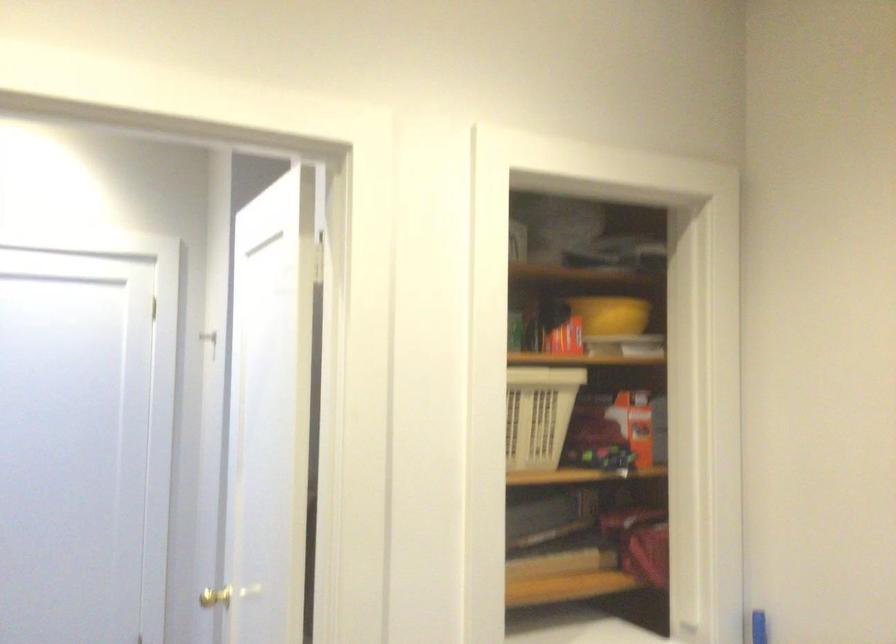
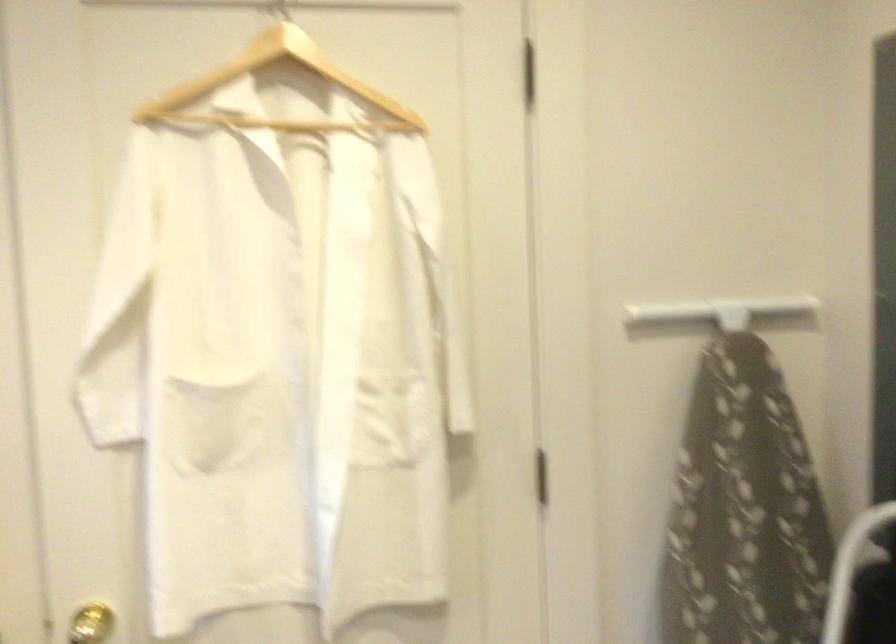
Question: How did the camera likely rotate?

Choices:
 (A) Left
 (B) Right
 (C) Up
 (D) Down

Answer: (A)